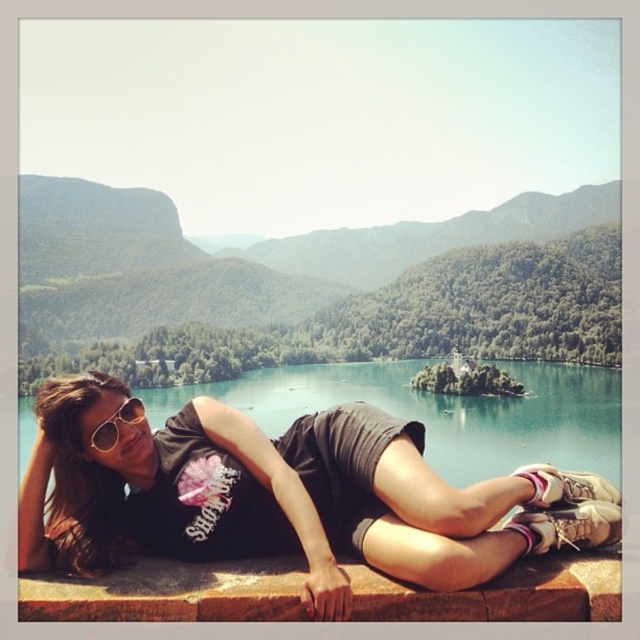
You are a photographer trying to capture the person in the matte black shirt at center. The camera you are using has a focus point at coordinate [285,497]. Will this focus point be effective for capturing the person?

The point at coordinate [285,497] indicates the matte black shirt at center, so yes, the focus point at [285,497] will effectively capture the person in the matte black shirt at center.

What is located at the coordinates point (285, 497) in the image?

The matte black shirt at center is located at point (285, 497).

You are a photographer trying to capture a photo of the matte black shirt at center and the brown stone ledge at lower center. Which object should you focus on first if you want to ensure both are in sharp focus, considering their sizes in the frame?

The matte black shirt at center is much taller than the brown stone ledge at lower center, so focusing on the larger object first will help ensure both are in sharp focus.